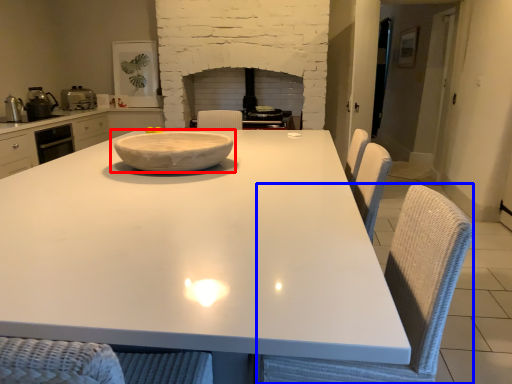
Question: Which point is further to the camera, bowl (highlighted by a red box) or swivel chair (highlighted by a blue box)?

Choices:
 (A) bowl
 (B) swivel chair

Answer: (A)